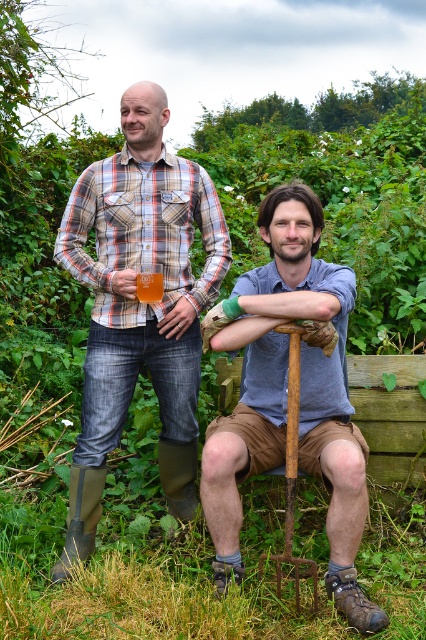
How distant is plaid shirt at left from blue denim shirt at center?

plaid shirt at left and blue denim shirt at center are 28.76 inches apart.

Consider the image. Between plaid shirt at left and blue denim shirt at center, which one appears on the right side from the viewer's perspective?

Positioned to the right is blue denim shirt at center.

You are a GUI agent. You are given a task and a screenshot of the screen. Output one action in this format:
    pyautogui.click(x=<x>, y=<y>)
    Task: Click on the plaid shirt at left
    The image size is (426, 640).
    Given the screenshot: What is the action you would take?
    pyautogui.click(x=138, y=305)

Between point (307, 410) and point (285, 488), which one is positioned behind?

The point (285, 488) is behind.

Who is positioned more to the right, plaid shirt at upper left or rusty metal shovel at center?

Positioned to the right is rusty metal shovel at center.

This screenshot has width=426, height=640. I want to click on plaid shirt at upper left, so click(284, 397).

The height and width of the screenshot is (640, 426). Describe the element at coordinates (284, 397) in the screenshot. I see `plaid shirt at upper left` at that location.

The height and width of the screenshot is (640, 426). What are the coordinates of `plaid shirt at upper left` in the screenshot? It's located at (284, 397).